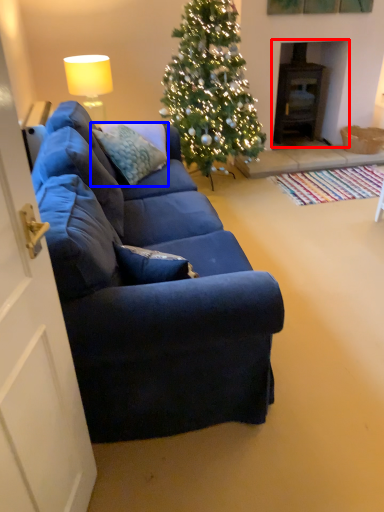
Question: Which point is closer to the camera, fireplace (highlighted by a red box) or pillow (highlighted by a blue box)?

Choices:
 (A) fireplace
 (B) pillow

Answer: (B)